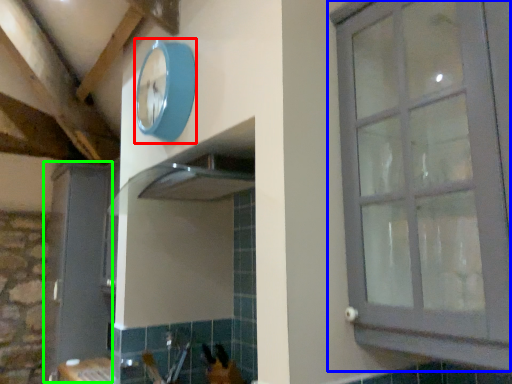
Question: Based on their relative distances, which object is farther from clock (highlighted by a red box)? Choose from window (highlighted by a blue box) and screen door (highlighted by a green box).

Choices:
 (A) window
 (B) screen door

Answer: (B)